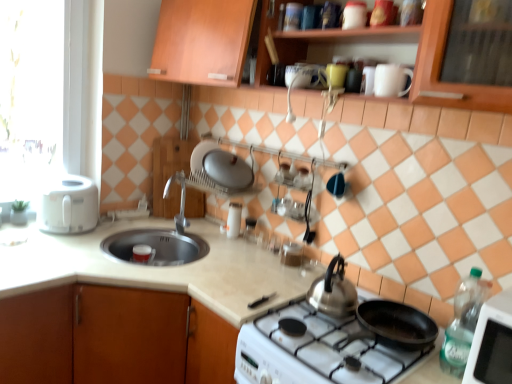
Locate an element on the screen. free space in front of metallic silver toaster at upper left, placed as the 2th appliance when sorted from left to right is located at coordinates (242, 248).